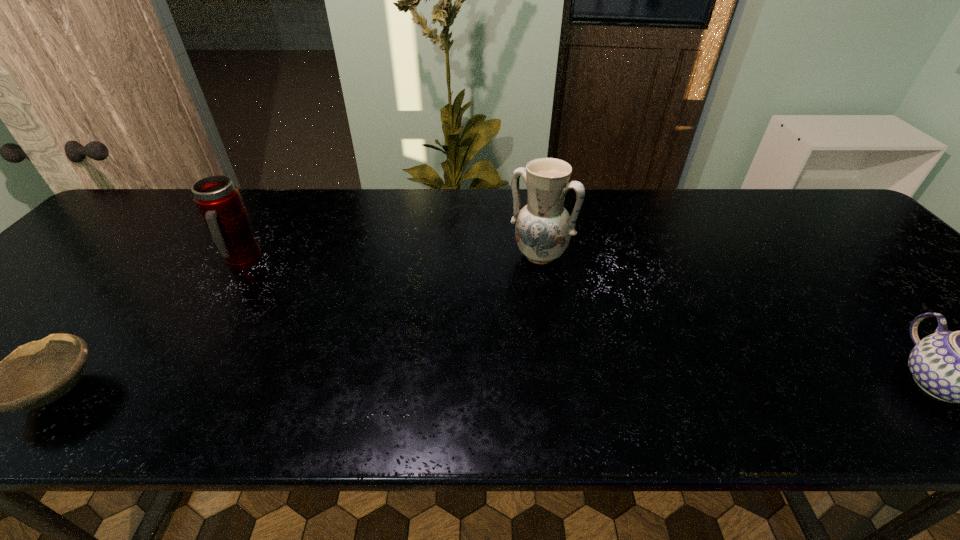
This screenshot has width=960, height=540. Identify the location of free space at the left edge of the desktop. (96, 235).

Identify the location of free space at the right edge of the desktop. (908, 272).

This screenshot has width=960, height=540. What are the coordinates of `free space at the far right corner` in the screenshot? It's located at (791, 192).

Select which object is the closest to the third object from left to right. Please provide its 2D coordinates. Your answer should be formatted as a tuple, i.e. [(x, y)], where the tuple contains the x and y coordinates of a point satisfying the conditions above.

[(959, 367)]

I want to click on object that stands as the second closest to the thermos bottle, so click(x=543, y=230).